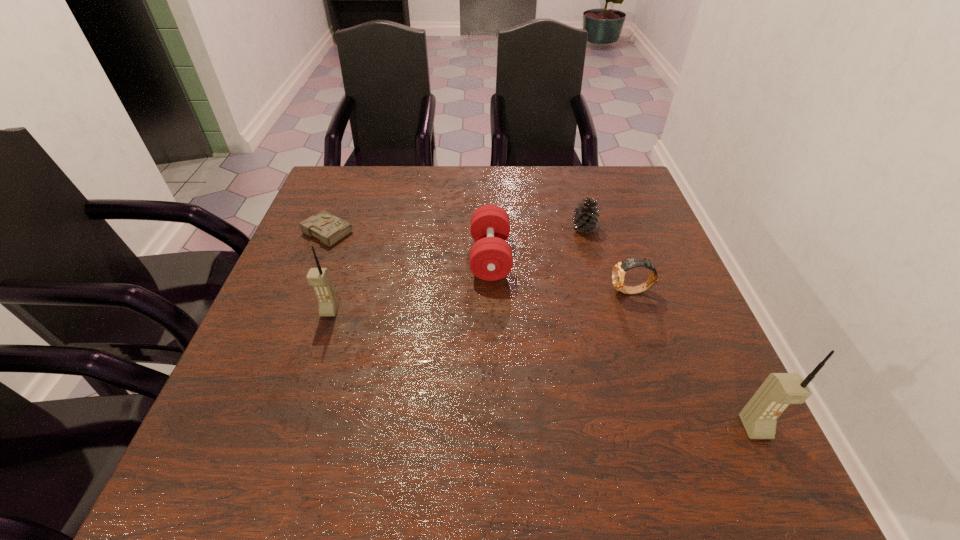
Locate an element on the screen. vacant area that lies between the farther cellular telephone and the watch is located at coordinates (481, 301).

Identify the location of vacant area that lies between the dumbbell and the fifth shortest object. This screenshot has height=540, width=960. (410, 284).

Locate an element on the screen. The height and width of the screenshot is (540, 960). vacant region between the fifth shortest object and the shortest object is located at coordinates (329, 271).

I want to click on free area in between the rightmost object and the shorter cellular telephone, so click(x=542, y=369).

Identify the location of vacant area that lies between the taller cellular telephone and the shortest object. (541, 329).

The width and height of the screenshot is (960, 540). Identify the location of free space between the watch and the fifth farthest object. (481, 301).

At what (x,y) coordinates should I click in order to perform the action: click on empty location between the diary and the dumbbell. Please return your answer as a coordinate pair (x, y). Looking at the image, I should click on (409, 244).

Find the location of a particular element. object that is the closest to the taller cellular telephone is located at coordinates (618, 273).

Select which object is the third closest to the taller cellular telephone. Please provide its 2D coordinates. Your answer should be formatted as a tuple, i.e. [(x, y)], where the tuple contains the x and y coordinates of a point satisfying the conditions above.

[(585, 218)]

Locate an element on the screen. vacant space that satisfies the following two spatial constraints: 1. on the back side of the pinecone; 2. on the right side of the shortest object is located at coordinates (330, 228).